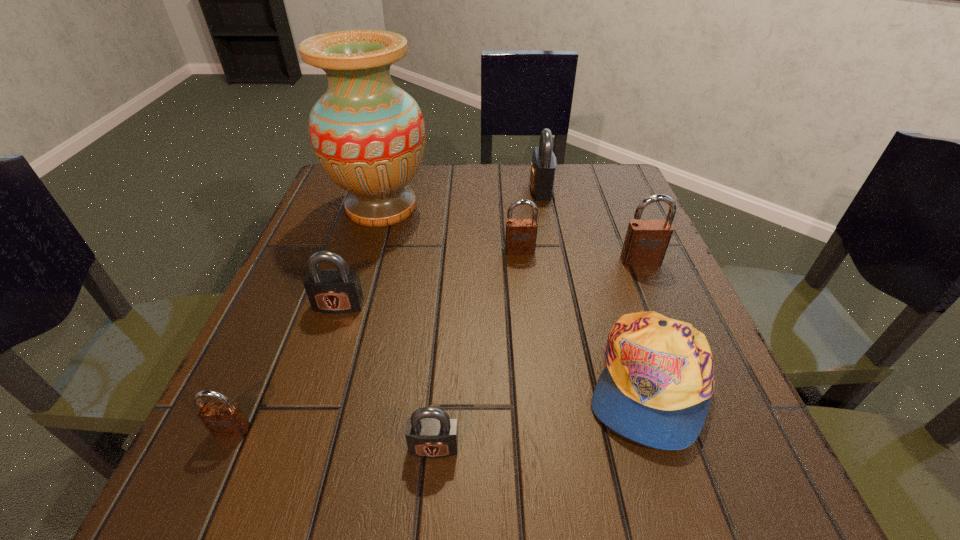
Find the location of `vacant area between the fourth farthest object and the biggest gray padlock`. vacant area between the fourth farthest object and the biggest gray padlock is located at coordinates (590, 225).

Image resolution: width=960 pixels, height=540 pixels. I want to click on vacant area between the fifth padlock from right to left and the fifth nearest padlock, so point(429,278).

Locate an element on the screen. free space between the rightmost padlock and the farthest gray padlock is located at coordinates (590, 225).

You are a GUI agent. You are given a task and a screenshot of the screen. Output one action in this format:
    pyautogui.click(x=<x>, y=<y>)
    Task: Click on the free space that is in between the second gray padlock from right to left and the second smallest gray padlock
    This screenshot has height=540, width=960.
    Given the screenshot: What is the action you would take?
    pyautogui.click(x=386, y=376)

Find the location of a particular element. The width and height of the screenshot is (960, 540). free space between the nearest brown padlock and the second gray padlock from left to right is located at coordinates (333, 438).

Locate an element on the screen. free space between the smallest gray padlock and the farthest padlock is located at coordinates (488, 318).

Where is `vacant space that's between the second brown padlock from right to left and the second farthest brown padlock`? vacant space that's between the second brown padlock from right to left and the second farthest brown padlock is located at coordinates (580, 256).

You are a GUI agent. You are given a task and a screenshot of the screen. Output one action in this format:
    pyautogui.click(x=<x>, y=<y>)
    Task: Click on the object that is the second closest to the fifth object from left to right
    This screenshot has height=540, width=960.
    Given the screenshot: What is the action you would take?
    pyautogui.click(x=646, y=241)

Find the location of a particular element. The image size is (960, 540). the sixth closest object to the rightmost brown padlock is located at coordinates (334, 291).

Where is `the second closest padlock to the cap`? The height and width of the screenshot is (540, 960). the second closest padlock to the cap is located at coordinates pyautogui.click(x=430, y=433).